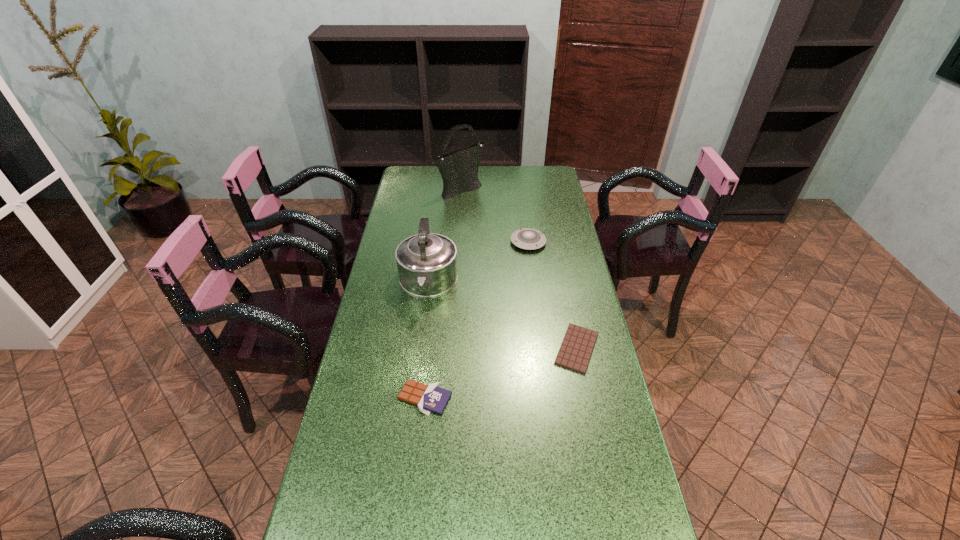
Locate an element on the screen. The image size is (960, 540). vacant space located on the back of the farthest object is located at coordinates (463, 171).

I want to click on blank space located with the spout at the front of the third nearest object, so click(410, 423).

Identify the location of vacant space located 0.340m on the front of the saucer. (539, 320).

Identify the location of vacant space located on the back of the left chocolate bar. (430, 350).

In order to click on free space located on the front of the second nearest object in this screenshot , I will do `click(592, 423)`.

At what (x,y) coordinates should I click in order to perform the action: click on object situated at the far edge. Please return your answer as a coordinate pair (x, y). The height and width of the screenshot is (540, 960). Looking at the image, I should click on (459, 169).

Find the location of a particular element. This screenshot has height=540, width=960. kettle situated at the left edge is located at coordinates (427, 263).

You are a GUI agent. You are given a task and a screenshot of the screen. Output one action in this format:
    pyautogui.click(x=<x>, y=<y>)
    Task: Click on the chocolate bar that is at the left edge
    This screenshot has height=540, width=960.
    Given the screenshot: What is the action you would take?
    pyautogui.click(x=429, y=398)

Identify the location of saucer at the right edge. The image size is (960, 540). (530, 239).

Locate an element on the screen. chocolate bar positioned at the right edge is located at coordinates (574, 354).